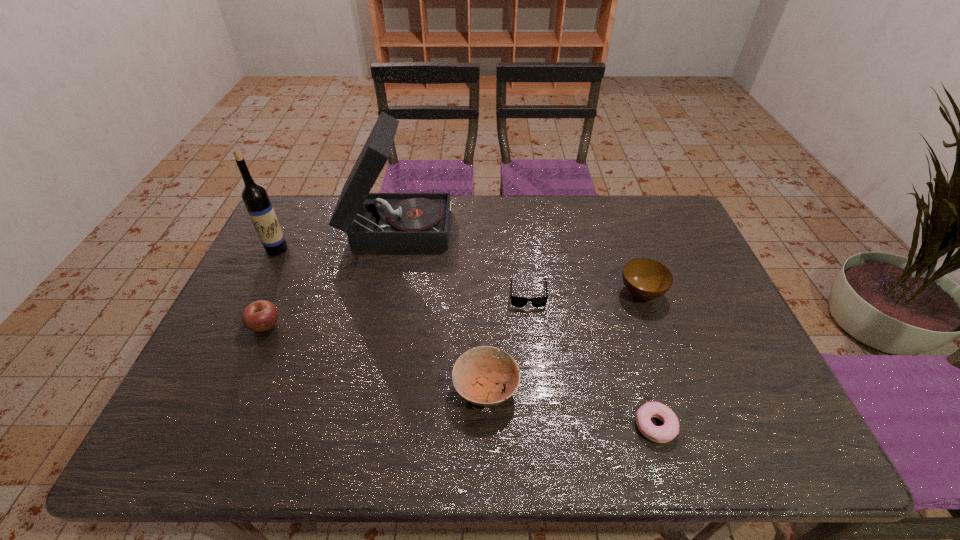
The height and width of the screenshot is (540, 960). What are the coordinates of `vacant region that satisfies the following two spatial constraints: 1. on the front-facing side of the phonograph_record; 2. on the side of the apple with the unique marking` in the screenshot? It's located at (376, 326).

You are a GUI agent. You are given a task and a screenshot of the screen. Output one action in this format:
    pyautogui.click(x=<x>, y=<y>)
    Task: Click on the vacant region that satisfies the following two spatial constraints: 1. on the label of the wine bottle; 2. on the left side of the shortest object
    This screenshot has height=540, width=960.
    Given the screenshot: What is the action you would take?
    [x=190, y=426]

I want to click on vacant region that satisfies the following two spatial constraints: 1. on the front-facing side of the right bowl; 2. on the right side of the phonograph_record, so click(x=383, y=293).

The width and height of the screenshot is (960, 540). What are the coordinates of `free location that satisfies the following two spatial constraints: 1. on the front-facing side of the third object from left to right; 2. on the back side of the right bowl` in the screenshot? It's located at (383, 293).

Find the location of a particular element. vacant position in the image that satisfies the following two spatial constraints: 1. on the front-facing side of the fifth object from right to left; 2. on the label of the wine bottle is located at coordinates (393, 249).